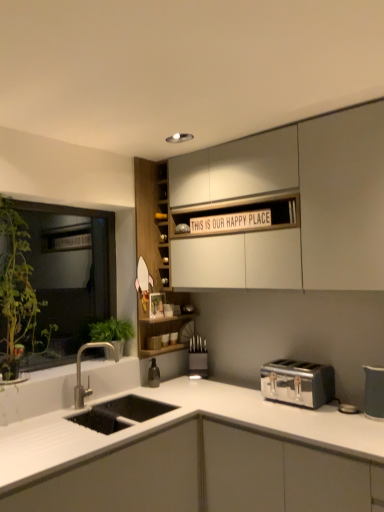
At what (x,y) coordinates should I click in order to perform the action: click on free spot in front of metallic knife block at center, which is the 1th appliance from left to right. Please return your answer as a coordinate pair (x, y). Image resolution: width=384 pixels, height=512 pixels. Looking at the image, I should click on (199, 385).